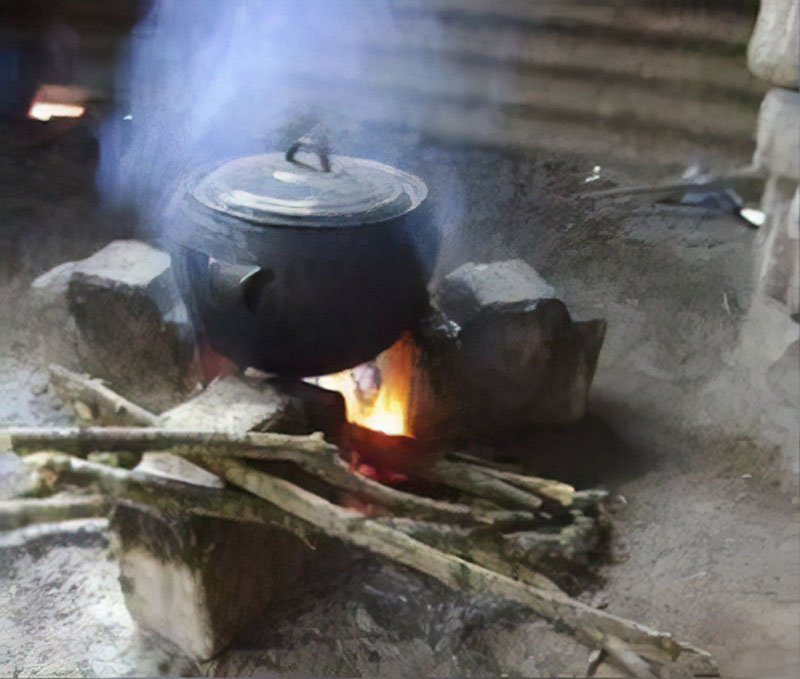
Identify the location of black pot. point(330,297).